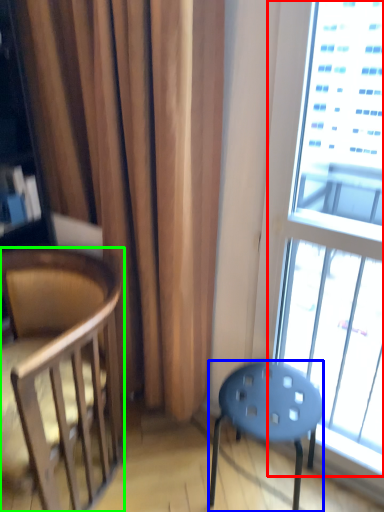
Question: Estimate the real-world distances between objects in this image. Which object is farther from window (highlighted by a red box), stool (highlighted by a blue box) or chair (highlighted by a green box)?

Choices:
 (A) stool
 (B) chair

Answer: (B)